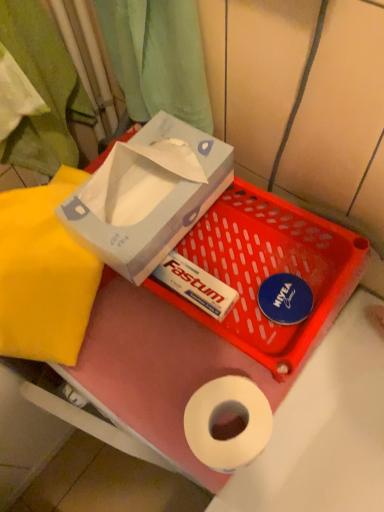
Question: Can you confirm if white cardboard box at upper left, which is the 1th box from top to bottom, is wider than yellow fabric at left?

Choices:
 (A) yes
 (B) no

Answer: (A)

Question: From a real-world perspective, is white cardboard box at upper left, the 2th box from the bottom, over yellow fabric at left?

Choices:
 (A) yes
 (B) no

Answer: (A)

Question: Is white cardboard box at upper left, the 2th box from the bottom, not within yellow fabric at left?

Choices:
 (A) yes
 (B) no

Answer: (A)

Question: Is the depth of white cardboard box at upper left, the 2th box from the bottom, greater than that of yellow fabric at left?

Choices:
 (A) no
 (B) yes

Answer: (A)

Question: Can you confirm if white cardboard box at upper left, which is the 1th box from top to bottom, is bigger than yellow fabric at left?

Choices:
 (A) no
 (B) yes

Answer: (A)

Question: Is white cardboard box at upper left, the 2th box from the bottom, shorter than yellow fabric at left?

Choices:
 (A) yes
 (B) no

Answer: (B)

Question: From a real-world perspective, is white cardboard box at upper left, which is the 1th box from top to bottom, on top of white cardboard box at upper center, positioned as the first box in bottom-to-top order?

Choices:
 (A) yes
 (B) no

Answer: (A)

Question: Is white cardboard box at upper center, the second box in the top-to-bottom sequence, surrounded by white cardboard box at upper left, the 2th box from the bottom?

Choices:
 (A) no
 (B) yes

Answer: (A)

Question: Can you confirm if white cardboard box at upper left, which is the 1th box from top to bottom, is thinner than white cardboard box at upper center, positioned as the first box in bottom-to-top order?

Choices:
 (A) yes
 (B) no

Answer: (A)

Question: From a real-world perspective, is white cardboard box at upper left, which is the 1th box from top to bottom, physically below white cardboard box at upper center, positioned as the first box in bottom-to-top order?

Choices:
 (A) yes
 (B) no

Answer: (B)

Question: Are white cardboard box at upper left, which is the 1th box from top to bottom, and white cardboard box at upper center, positioned as the first box in bottom-to-top order, making contact?

Choices:
 (A) no
 (B) yes

Answer: (A)

Question: Can you confirm if white cardboard box at upper left, which is the 1th box from top to bottom, is bigger than white cardboard box at upper center, the second box in the top-to-bottom sequence?

Choices:
 (A) no
 (B) yes

Answer: (B)

Question: Does white cardboard box at upper center, positioned as the first box in bottom-to-top order, have a larger size compared to yellow fabric at left?

Choices:
 (A) no
 (B) yes

Answer: (A)